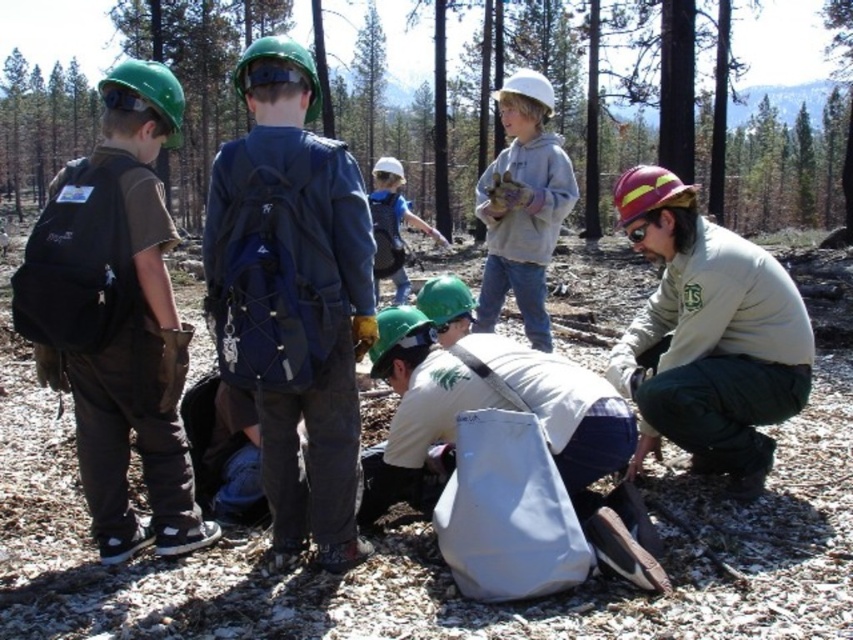
Based on the photo, is matte blue backpack at center wider than white matte helmet at center?

No, matte blue backpack at center is not wider than white matte helmet at center.

Is point (228, 291) more distant than point (393, 209)?

No, it is not.

Who is more distant from viewer, (352, 205) or (389, 275)?

Positioned behind is point (389, 275).

The image size is (853, 640). Find the location of `matte blue backpack at center`. matte blue backpack at center is located at coordinates (293, 300).

Does brown textured dirt at center have a larger size compared to matte blue backpack at center?

Indeed, brown textured dirt at center has a larger size compared to matte blue backpack at center.

This screenshot has height=640, width=853. I want to click on brown textured dirt at center, so click(462, 99).

Looking at this image, measure the distance between brown textured dirt at center and camera.

The distance of brown textured dirt at center from camera is 18.26 feet.

Locate an element on the screen. brown textured dirt at center is located at coordinates (462, 99).

How much distance is there between matte blue backpack at center and black fabric backpack at left?

matte blue backpack at center and black fabric backpack at left are 52.54 centimeters apart.

Is matte blue backpack at center to the right of black fabric backpack at left from the viewer's perspective?

Yes, matte blue backpack at center is to the right of black fabric backpack at left.

Does point (289, 268) lie behind point (144, 150)?

No.

At what (x,y) coordinates should I click in order to perform the action: click on matte blue backpack at center. Please return your answer as a coordinate pair (x, y). The image size is (853, 640). Looking at the image, I should click on (293, 300).